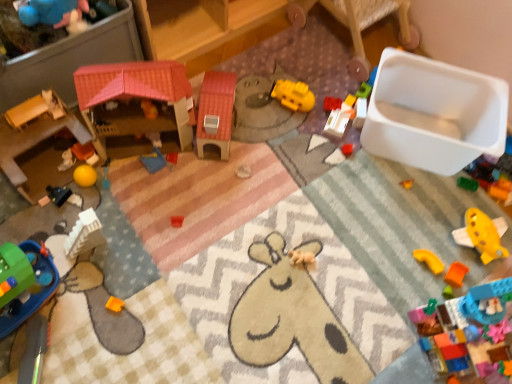
The height and width of the screenshot is (384, 512). What are the coordinates of `vacant area that is in front of white plastic container at upper right, the 1th furniture when ordered from right to left` in the screenshot? It's located at (316, 95).